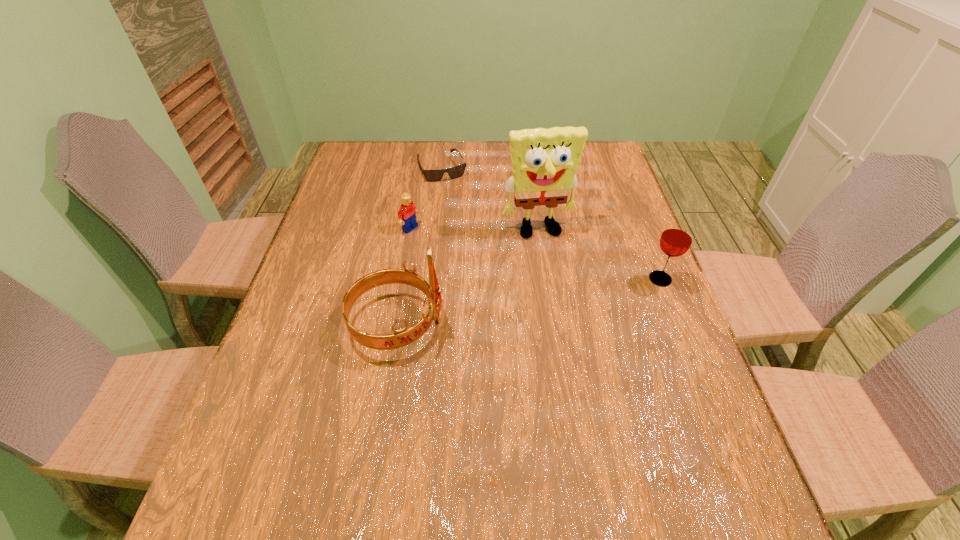
At what (x,y) coordinates should I click in order to perform the action: click on vacant space situated on the front of the rightmost object. Please return your answer as a coordinate pair (x, y). Looking at the image, I should click on (702, 385).

You are a GUI agent. You are given a task and a screenshot of the screen. Output one action in this format:
    pyautogui.click(x=<x>, y=<y>)
    Task: Click on the vacant space located on the face of the fourth object from left to right
    This screenshot has width=960, height=540.
    Given the screenshot: What is the action you would take?
    pyautogui.click(x=572, y=327)

Where is `vacant area situated on the face of the fourth object from left to right`? vacant area situated on the face of the fourth object from left to right is located at coordinates tap(558, 283).

I want to click on vacant space located 0.340m on the face of the fourth object from left to right, so click(578, 345).

I want to click on free space located on the front-facing side of the sunglasses, so click(460, 209).

This screenshot has width=960, height=540. In order to click on free region located on the front-facing side of the sunglasses in this screenshot , I will do `click(456, 201)`.

The width and height of the screenshot is (960, 540). I want to click on vacant space located on the front-facing side of the sunglasses, so click(464, 217).

The height and width of the screenshot is (540, 960). Identify the location of free location located on the front-facing side of the second shortest object. (508, 284).

The width and height of the screenshot is (960, 540). Identify the location of vacant point located on the front-facing side of the second shortest object. (524, 293).

At what (x,y) coordinates should I click in order to perform the action: click on free point located on the front-facing side of the second shortest object. Please return your answer as a coordinate pair (x, y). Image resolution: width=960 pixels, height=540 pixels. Looking at the image, I should click on (448, 251).